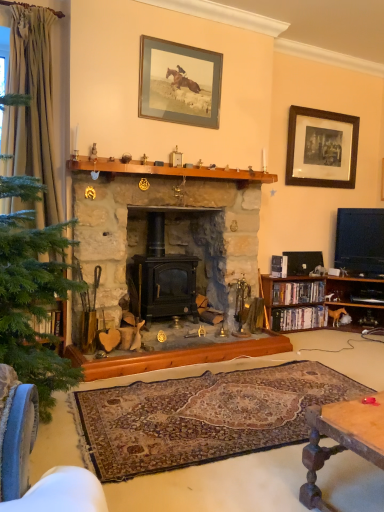
This screenshot has width=384, height=512. In order to click on vacant space in matte glass picture frame at upper center, the 2th picture frame from the back (from a real-world perspective) in this screenshot , I will do `click(174, 163)`.